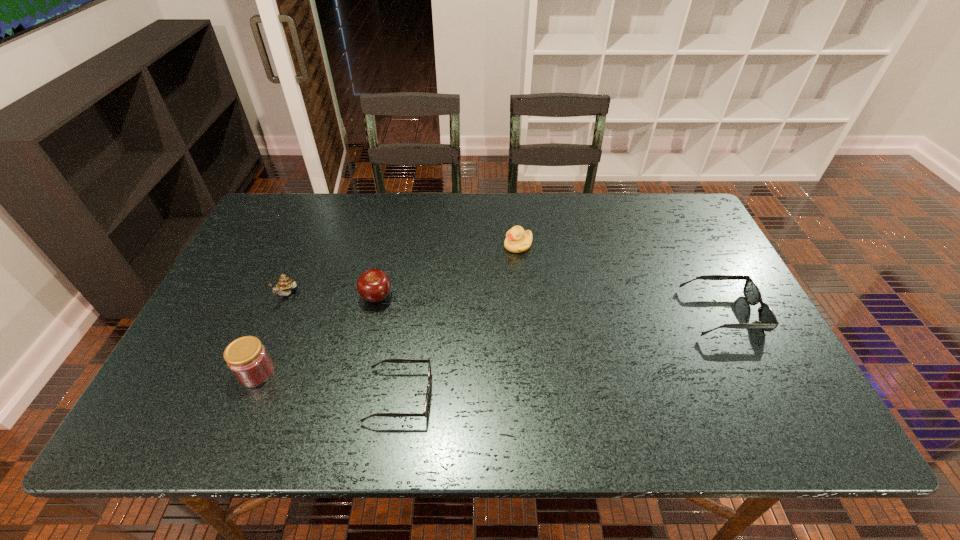
This screenshot has height=540, width=960. I want to click on vacant region between the third shortest object and the apple, so click(x=447, y=271).

Identify the location of unoccupied area between the second shortest object and the shortest object. (561, 355).

Where is `free space between the fifth object from left to right and the shorter sunglasses`? free space between the fifth object from left to right and the shorter sunglasses is located at coordinates (459, 321).

Identify the location of free area in between the jam and the rightmost object. (490, 343).

This screenshot has height=540, width=960. Identify the location of empty space that is in between the shortest object and the farthest object. (459, 321).

At what (x,y) coordinates should I click in order to perform the action: click on vacant area that lies between the jam and the snail. Please return your answer as a coordinate pair (x, y). Looking at the image, I should click on [272, 334].

Identify the location of unoccupied position between the right sunglasses and the jam. coord(490,343).

At what (x,y) coordinates should I click in order to perform the action: click on free space between the snail and the jam. Please return your answer as a coordinate pair (x, y). The width and height of the screenshot is (960, 540). Looking at the image, I should click on (272, 334).

Identify which object is the third closest to the shortest object. Please provide its 2D coordinates. Your answer should be formatted as a tuple, i.e. [(x, y)], where the tuple contains the x and y coordinates of a point satisfying the conditions above.

[(285, 284)]

This screenshot has height=540, width=960. Find the location of `the fifth closest object to the snail`. the fifth closest object to the snail is located at coordinates (767, 319).